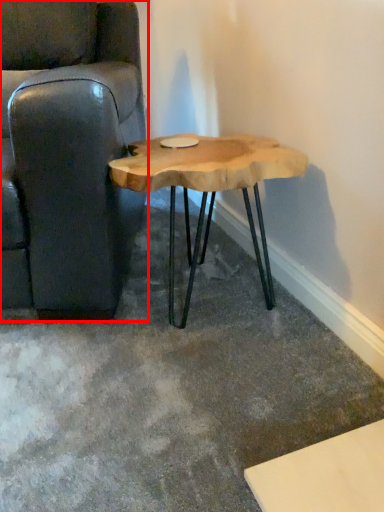
Question: In this image, where is chair (annotated by the red box) located relative to coffee table?

Choices:
 (A) left
 (B) right

Answer: (A)